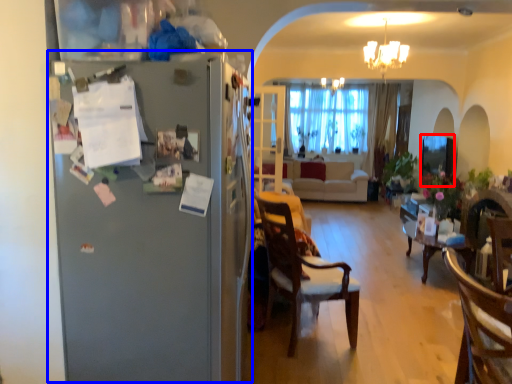
Question: Among these objects, which one is nearest to the camera, window screen (highlighted by a red box) or fridge (highlighted by a blue box)?

Choices:
 (A) window screen
 (B) fridge

Answer: (B)